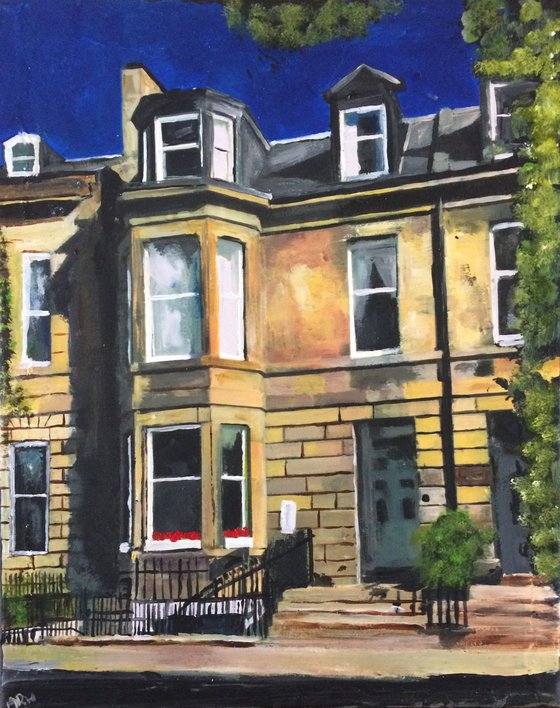
Locate an element on the screen. Image resolution: width=560 pixels, height=708 pixels. wrought iron railing left and right of stairs, bottom right of image is located at coordinates (448, 610), (256, 590), (282, 564), (298, 549).